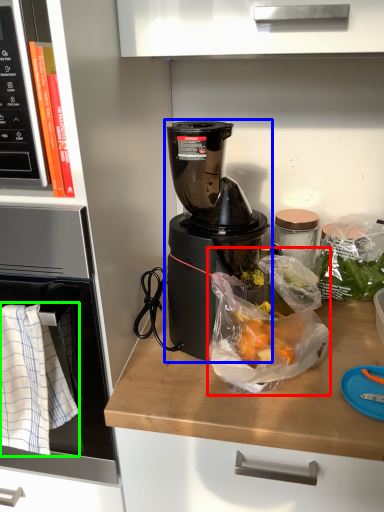
Question: Considering the real-world distances, which object is farthest from plastic bag (highlighted by a red box)? blender (highlighted by a blue box) or cloth (highlighted by a green box)?

Choices:
 (A) blender
 (B) cloth

Answer: (B)